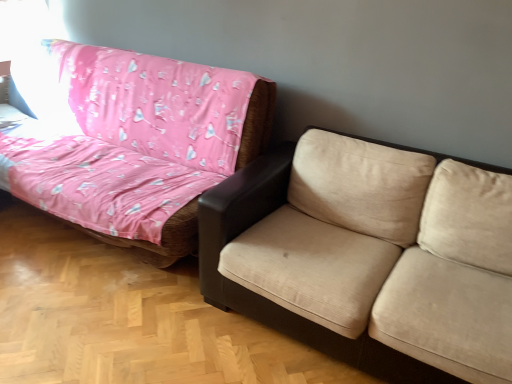
What do you see at coordinates (133, 142) in the screenshot? Image resolution: width=512 pixels, height=384 pixels. I see `pink fabric studio couch at left` at bounding box center [133, 142].

The image size is (512, 384). I want to click on pink fabric studio couch at left, so click(x=133, y=142).

The height and width of the screenshot is (384, 512). I want to click on pink fabric studio couch at left, so pyautogui.click(x=133, y=142).